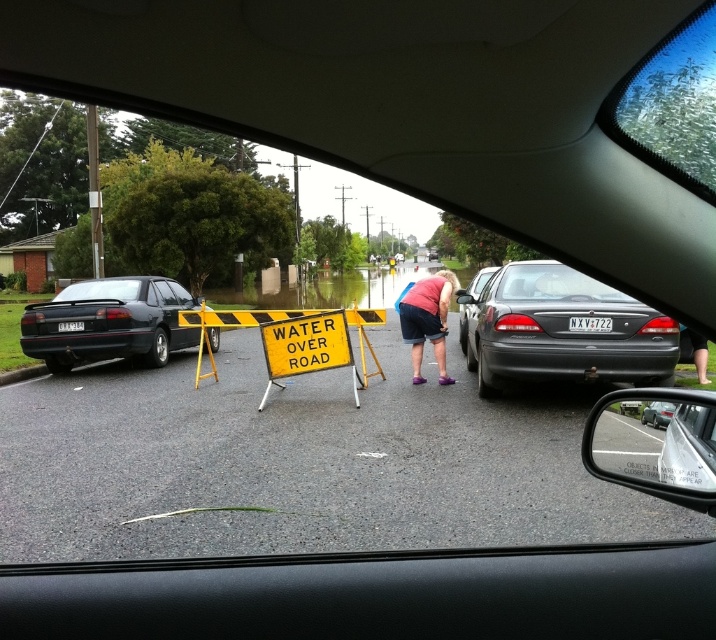
Question: Which point appears closest to the camera in this image?

Choices:
 (A) (498, 365)
 (B) (37, 339)

Answer: (A)

Question: Can you confirm if matte black sedan at right is bigger than matte black sedan at center?

Choices:
 (A) no
 (B) yes

Answer: (B)

Question: Which point is closer to the camera taking this photo?

Choices:
 (A) (662, 67)
 (B) (664, 406)

Answer: (A)

Question: Is matte black sedan at right wider than clear glass car window at upper right?

Choices:
 (A) yes
 (B) no

Answer: (A)

Question: Is yellow plastic sign at center wider than pink fabric shirt at center?

Choices:
 (A) yes
 (B) no

Answer: (A)

Question: Which of the following is the farthest from the observer?

Choices:
 (A) matte black sedan at left
 (B) yellow plastic sign at center

Answer: (A)